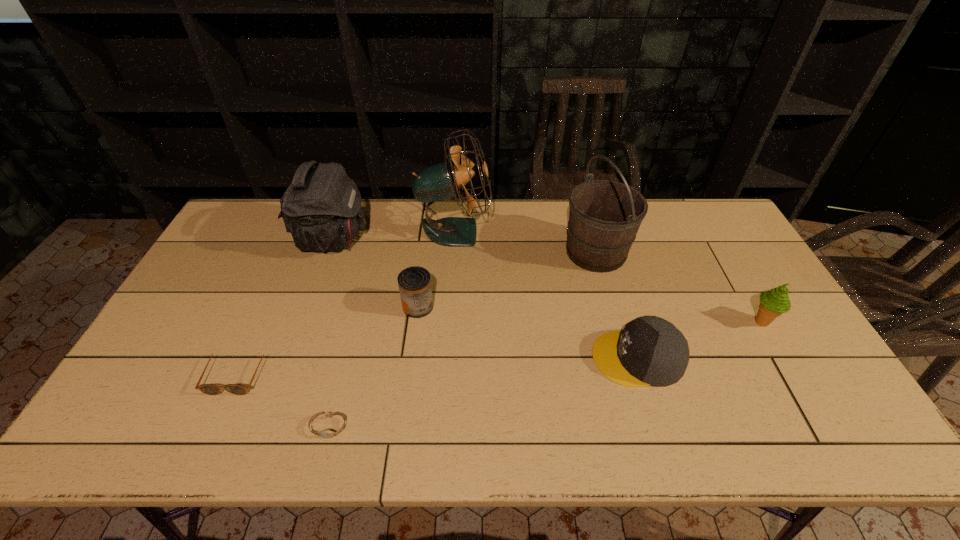
Identify the location of vacant space located 0.170m on the front-facing side of the fan for air flow. (540, 232).

Image resolution: width=960 pixels, height=540 pixels. I want to click on vacant space located on the right of the bucket, so click(659, 252).

Identify the location of vacant space located 0.310m on the open flap of the third tallest object. Image resolution: width=960 pixels, height=540 pixels. (460, 239).

Find the location of `vacant space located 0.120m on the left of the icecream`. vacant space located 0.120m on the left of the icecream is located at coordinates (705, 322).

Identify the location of vacant point located 0.290m on the left of the can. This screenshot has height=540, width=960. (302, 306).

In order to click on vacant space located 0.120m on the front-facing side of the cap in this screenshot , I will do `click(547, 358)`.

Identify the location of vacant space located on the front-facing side of the cap. Image resolution: width=960 pixels, height=540 pixels. (482, 358).

Locate an element on the screen. The height and width of the screenshot is (540, 960). free space located 0.250m on the front-facing side of the cap is located at coordinates 497,358.

Locate an element on the screen. Image resolution: width=960 pixels, height=540 pixels. free space located on the front-facing side of the seventh tallest object is located at coordinates (204, 448).

Find the location of `fan that is at the far edge`. fan that is at the far edge is located at coordinates (442, 181).